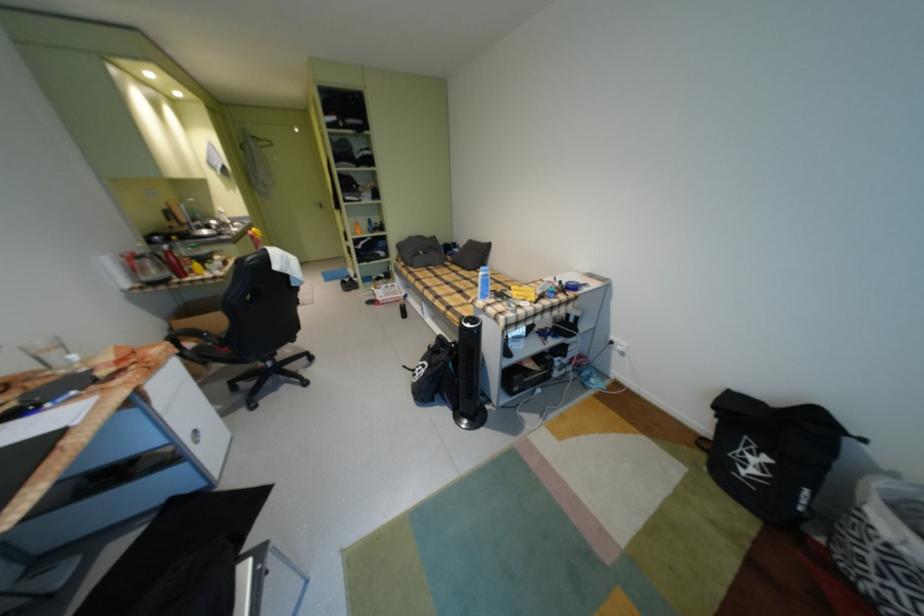
The location [358,228] corresponds to which object?

This point indicates the yellow bottle.